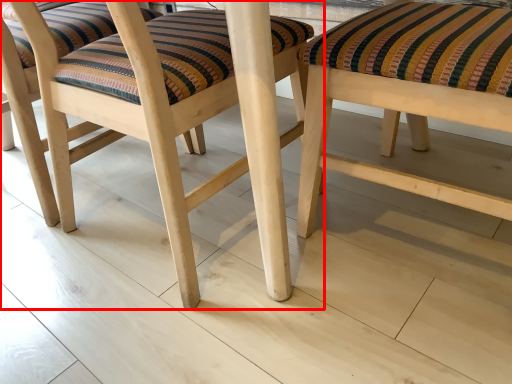
Question: Considering the relative positions of stool (annotated by the red box) and stool in the image provided, where is stool (annotated by the red box) located with respect to the staircase?

Choices:
 (A) right
 (B) left

Answer: (B)